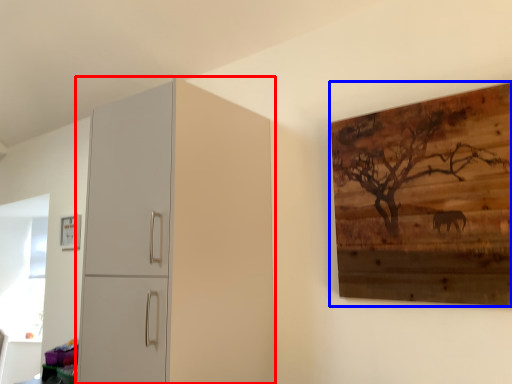
Question: Among these objects, which one is nearest to the camera, cupboard (highlighted by a red box) or picture frame (highlighted by a blue box)?

Choices:
 (A) cupboard
 (B) picture frame

Answer: (B)